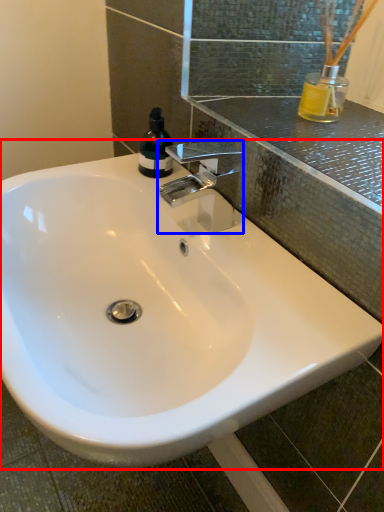
Question: Which point is further to the camera, sink (highlighted by a red box) or tap (highlighted by a blue box)?

Choices:
 (A) sink
 (B) tap

Answer: (B)